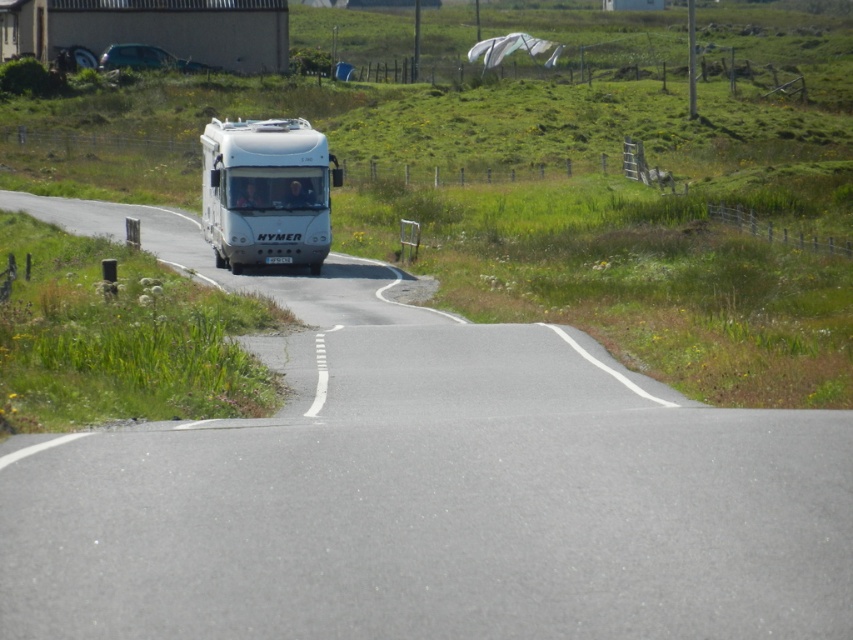
Who is shorter, white glossy bus at center or metallic silver rv at upper left?

Standing shorter between the two is metallic silver rv at upper left.

Looking at this image, between white glossy bus at center and metallic silver rv at upper left, which one is positioned higher?

Positioned higher is metallic silver rv at upper left.

Is point (277, 211) positioned before point (140, 60)?

Yes, point (277, 211) is closer to viewer.

This screenshot has width=853, height=640. Find the location of `white glossy bus at center`. white glossy bus at center is located at coordinates (265, 193).